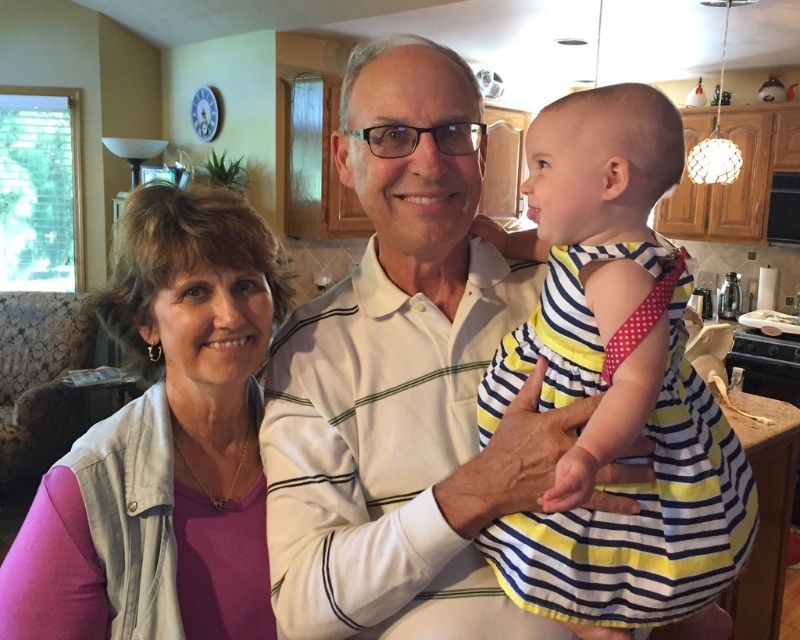
You have a small rectangular box that is 15 cm in width. You need to place it either on the striped cotton dress at center or the pink fabric at left. Which surface can it fit on without exceeding the width?

The striped cotton dress at center might be wider than pink fabric at left, so it is possible that the striped cotton dress at center can accommodate the 15 cm wide box without exceeding its width, while the pink fabric at left may be narrower. However, since the exact width isn not provided, we can only suggest trying the striped cotton dress at center first.

You are a photographer standing 1 meter away from the point at coordinates point (356, 328). Can you take a clear photo of the baby girl in the yellow and navy striped dress with red polka dots on the straps without moving closer?

The point (356, 328) is 93.08 centimeters away from the viewer, which is less than 1 meter. Therefore, you are already closer than 1 meter to the point, so you can take a clear photo of the baby girl in the yellow and navy striped dress with red polka dots on the straps without needing to move closer.